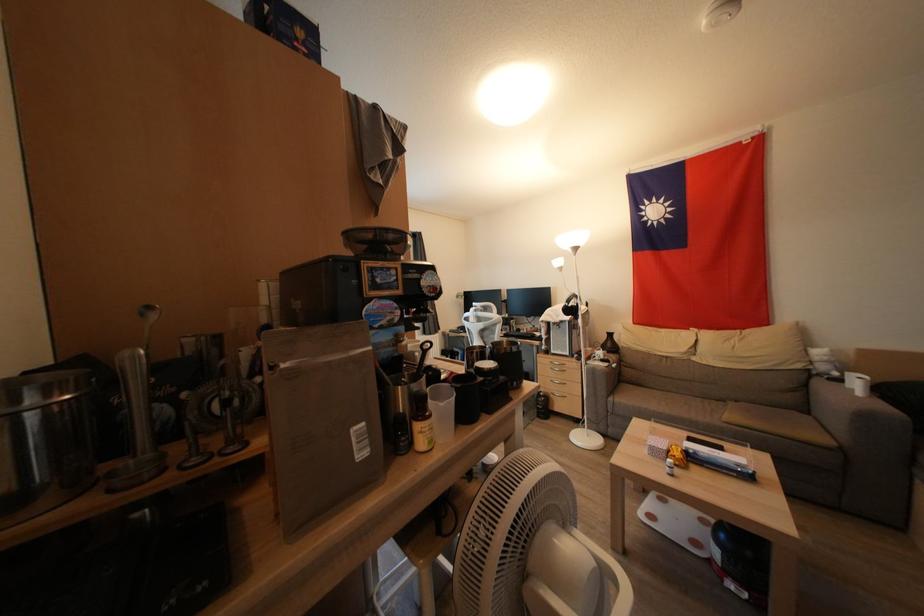
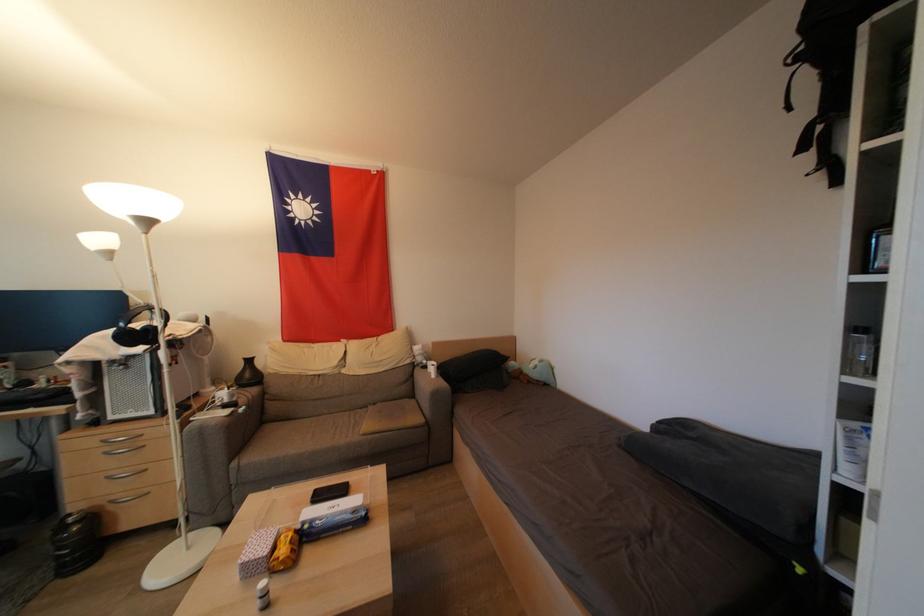
In the second image, find the point that corresponds to point 888,394 in the first image.

(445, 373)